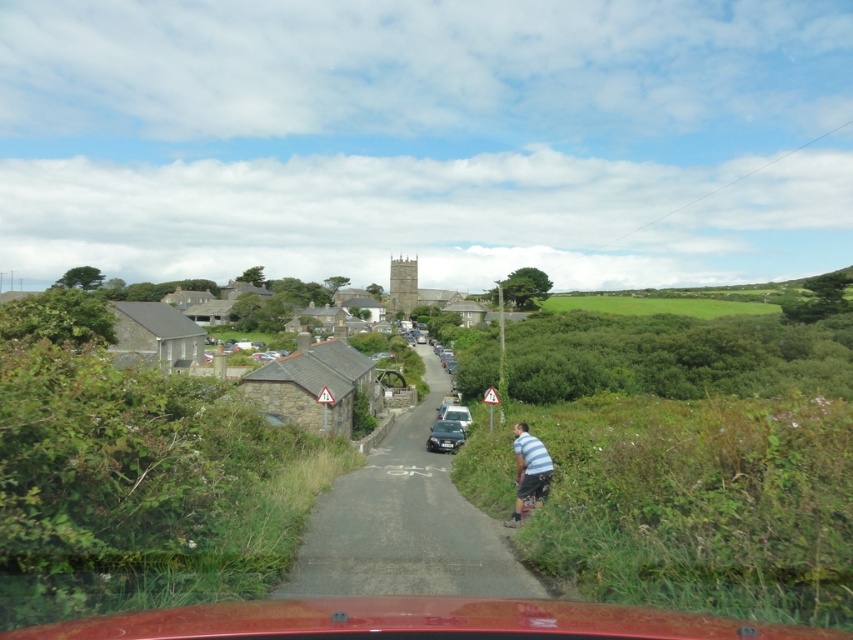
You are a passenger in the satin silver car at center and notice a pedestrian wearing a striped cotton shirt at lower right. From your viewpoint inside the car, where is the pedestrian relative to the car?

The striped cotton shirt at lower right is located above the satin silver car at center, meaning the pedestrian is positioned higher up relative to the car, possibly on elevated ground or a structure overlooking the road.

You are driving a car and want to reach the church or institutional building ahead. There is a point at coordinates point (404, 524) on asphalt road at center. Is this point located on the road that leads to the church or institutional building?

The point (404, 524) is on asphalt road at center, which is the road leading to the church or institutional building. Therefore, the point is located on the road leading to the destination.